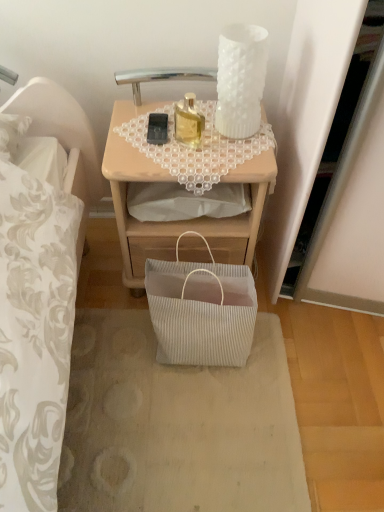
This screenshot has height=512, width=384. Find the location of `free spot in front of black matte mobile phone at upper center`. free spot in front of black matte mobile phone at upper center is located at coordinates (157, 156).